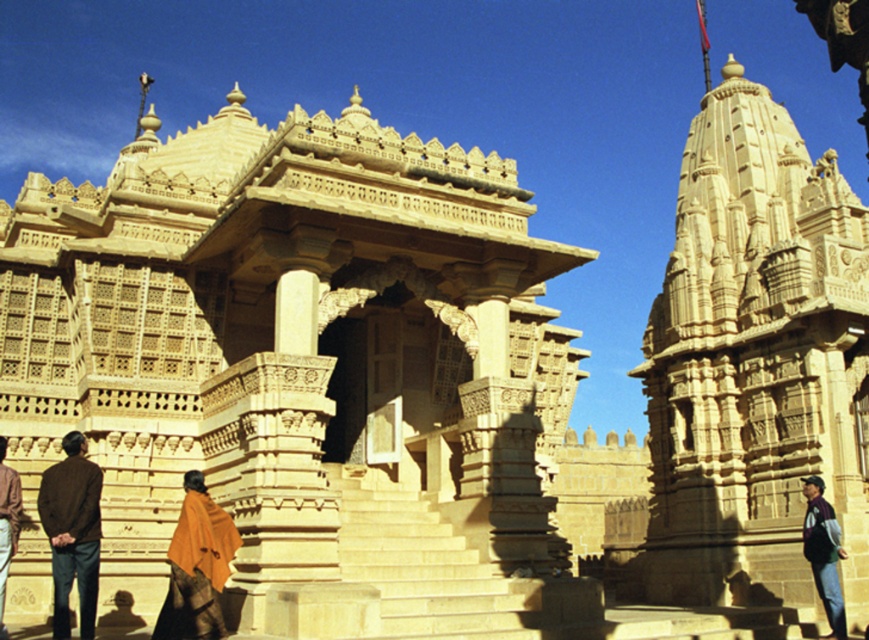
Question: Estimate the real-world distances between objects in this image. Which object is closer to the brown fabric at lower left?

Choices:
 (A) orange fabric shawl at lower left
 (B) dark purple sweater at right
 (C) brown fabric coat at lower left
 (D) beige stone hindu temple at center

Answer: (C)

Question: Is brown fabric coat at lower left further to the viewer compared to brown fabric at lower left?

Choices:
 (A) yes
 (B) no

Answer: (A)

Question: Where is beige stone hindu temple at center located in relation to dark purple sweater at right in the image?

Choices:
 (A) left
 (B) right

Answer: (A)

Question: Which point is farther from the camera taking this photo?

Choices:
 (A) (695, 384)
 (B) (188, 532)
 (C) (96, 484)

Answer: (A)

Question: Estimate the real-world distances between objects in this image. Which object is farther from the brown fabric at lower left?

Choices:
 (A) beige stone temple at upper right
 (B) orange fabric shawl at lower left

Answer: (A)

Question: Can you confirm if beige stone temple at upper right is wider than brown fabric at lower left?

Choices:
 (A) yes
 (B) no

Answer: (A)